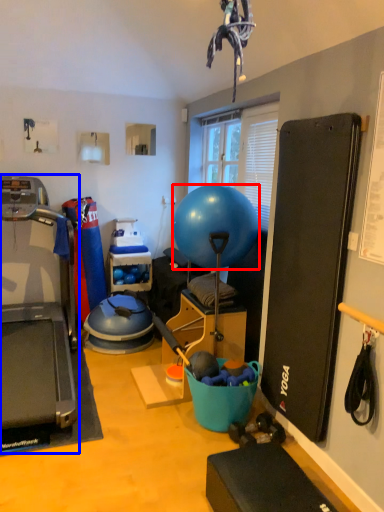
Question: Which point is closer to the camera, ball (highlighted by a red box) or treadmill (highlighted by a blue box)?

Choices:
 (A) ball
 (B) treadmill

Answer: (B)